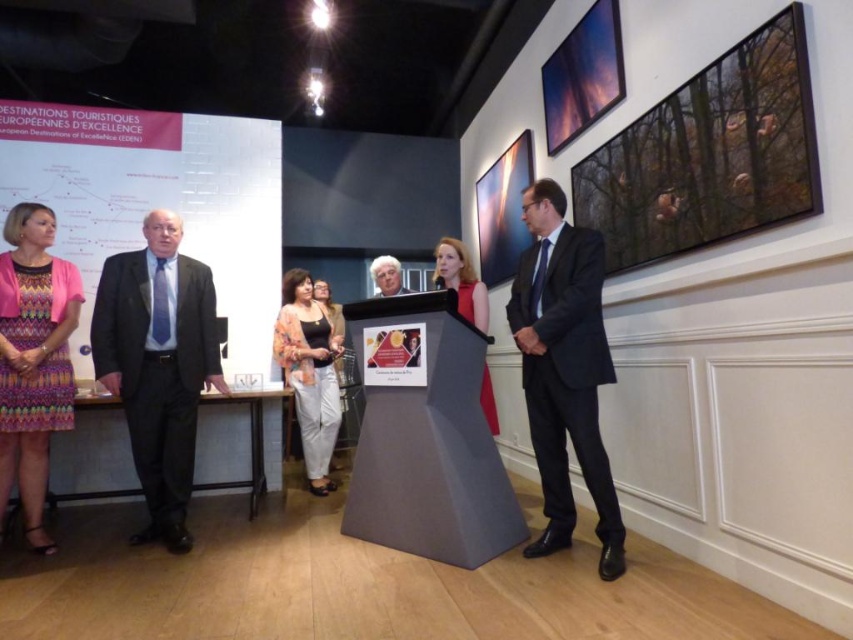
Question: Which point is farther to the camera?

Choices:
 (A) wooden-framed painting at upper right
 (B) multicolored printed dress at left

Answer: (B)

Question: Observing the image, what is the correct spatial positioning of wooden-framed painting at upper right in reference to metallic silver picture frame at upper center?

Choices:
 (A) right
 (B) left

Answer: (A)

Question: Which of the following is the closest to the observer?

Choices:
 (A) dark blue suit at center
 (B) matte floral blouse at center
 (C) metallic silver picture frame at upper center

Answer: (A)

Question: Is wooden-framed painting at upper right to the left of matte gray podium at center from the viewer's perspective?

Choices:
 (A) yes
 (B) no

Answer: (B)

Question: Based on their relative distances, which object is farther from the matte red dress at center?

Choices:
 (A) matte gray podium at center
 (B) metallic glass picture frame at upper center
 (C) dark blue suit at center
 (D) metallic silver picture frame at upper center

Answer: (D)

Question: Is wooden-framed painting at upper right wider than matte black top at center?

Choices:
 (A) yes
 (B) no

Answer: (A)